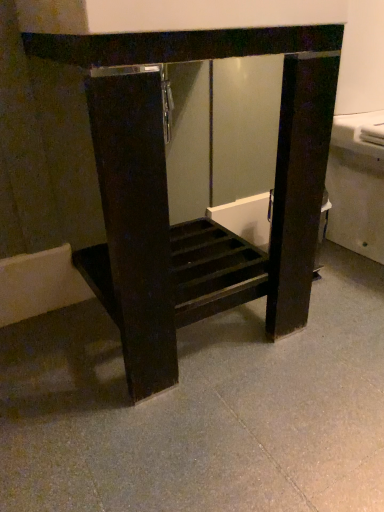
The image size is (384, 512). What are the coordinates of `free location in front of matte black cabinet at center` in the screenshot? It's located at (198, 429).